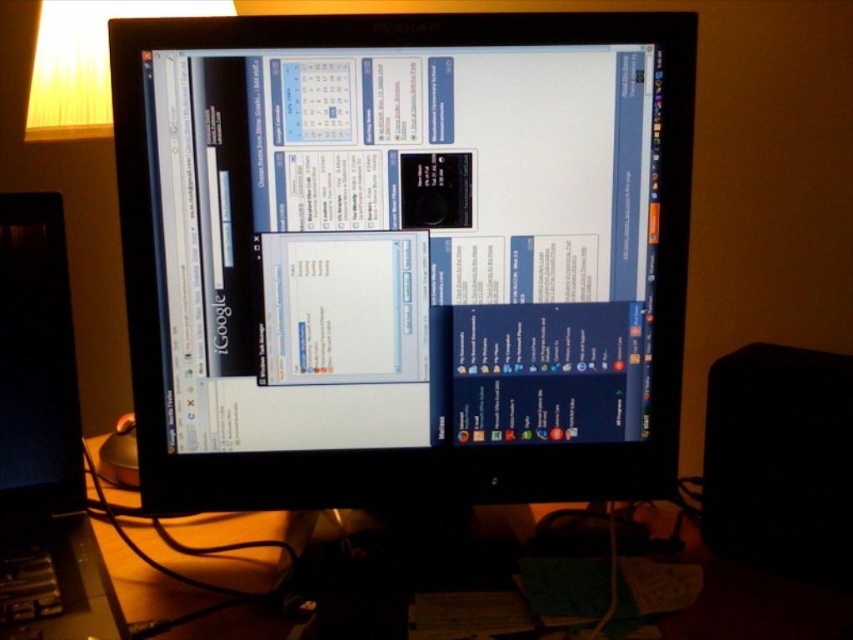
Question: Where is white glossy monitor at center located in relation to black glossy monitor at center in the image?

Choices:
 (A) below
 (B) above

Answer: (B)

Question: Is white glossy monitor at center thinner than black glossy monitor at center?

Choices:
 (A) yes
 (B) no

Answer: (B)

Question: Does white glossy monitor at center have a smaller size compared to black glossy monitor at center?

Choices:
 (A) yes
 (B) no

Answer: (B)